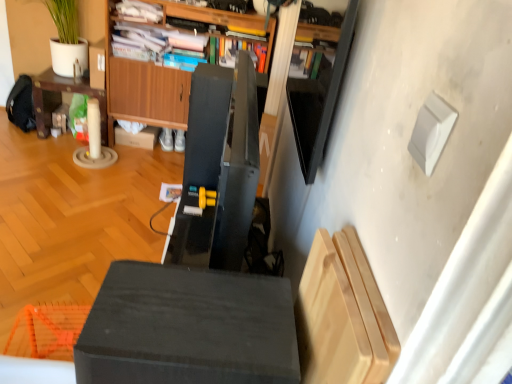
Question: Considering the positions of matte black cube at center and wooden cabinet at center in the image, is matte black cube at center wider or thinner than wooden cabinet at center?

Choices:
 (A) wide
 (B) thin

Answer: (B)

Question: From a real-world perspective, is matte black cube at center physically located above or below wooden cabinet at center?

Choices:
 (A) below
 (B) above

Answer: (B)

Question: Based on their relative distances, which object is farther from the wooden cabinet at center?

Choices:
 (A) light wood cutting board at lower right
 (B) matte black cube at center
 (C) matte brown table at left
 (D) brown cardboard box at center

Answer: (A)

Question: Which object is the closest to the matte brown table at left?

Choices:
 (A) light wood cutting board at lower right
 (B) brown cardboard box at center
 (C) wooden cabinet at center
 (D) matte black cube at center

Answer: (C)